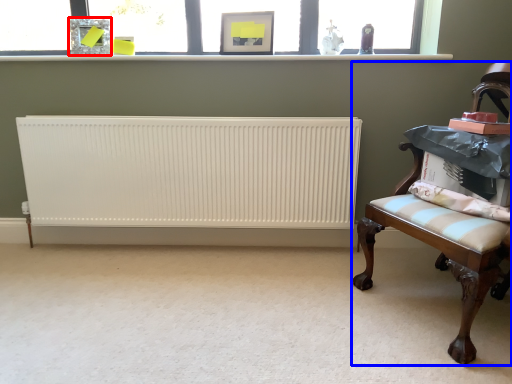
Question: Which of the following is the closest to the observer, picture frame (highlighted by a red box) or furniture (highlighted by a blue box)?

Choices:
 (A) picture frame
 (B) furniture

Answer: (B)